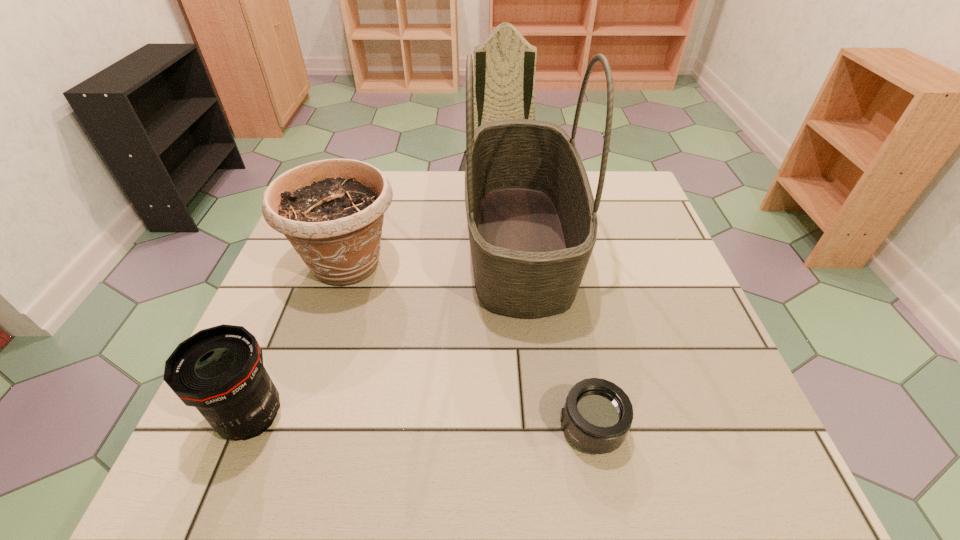
In the image, there is a desktop. Identify the location of vacant space at the far right corner. The width and height of the screenshot is (960, 540). (637, 218).

Locate an element on the screen. The width and height of the screenshot is (960, 540). vacant space that's between the tallest object and the flowerpot is located at coordinates (434, 253).

You are a GUI agent. You are given a task and a screenshot of the screen. Output one action in this format:
    pyautogui.click(x=<x>, y=<y>)
    Task: Click on the free space between the taller telephoto lens and the right telephoto lens
    The image size is (960, 540).
    Given the screenshot: What is the action you would take?
    pyautogui.click(x=421, y=422)

Where is `vacant space that's between the second tallest object and the third tallest object`? This screenshot has height=540, width=960. vacant space that's between the second tallest object and the third tallest object is located at coordinates (300, 341).

The height and width of the screenshot is (540, 960). Identify the location of free spot between the basket and the second tallest object. (434, 253).

The height and width of the screenshot is (540, 960). I want to click on vacant space in between the shorter telephoto lens and the third tallest object, so click(x=421, y=422).

Where is `vacant space that's between the shorter telephoto lens and the flowerpot`? Image resolution: width=960 pixels, height=540 pixels. vacant space that's between the shorter telephoto lens and the flowerpot is located at coordinates (469, 346).

I want to click on free area in between the tallest object and the shortest object, so click(x=556, y=335).

Find the location of a particular element. The width and height of the screenshot is (960, 540). free space between the left telephoto lens and the flowerpot is located at coordinates (300, 341).

Image resolution: width=960 pixels, height=540 pixels. What are the coordinates of `free point between the second tallest object and the taller telephoto lens` in the screenshot? It's located at (300, 341).